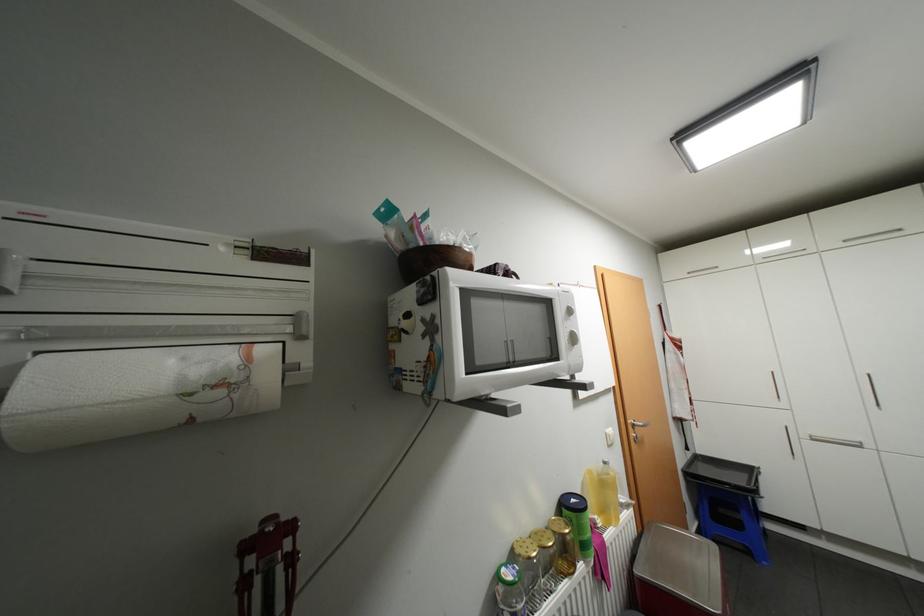
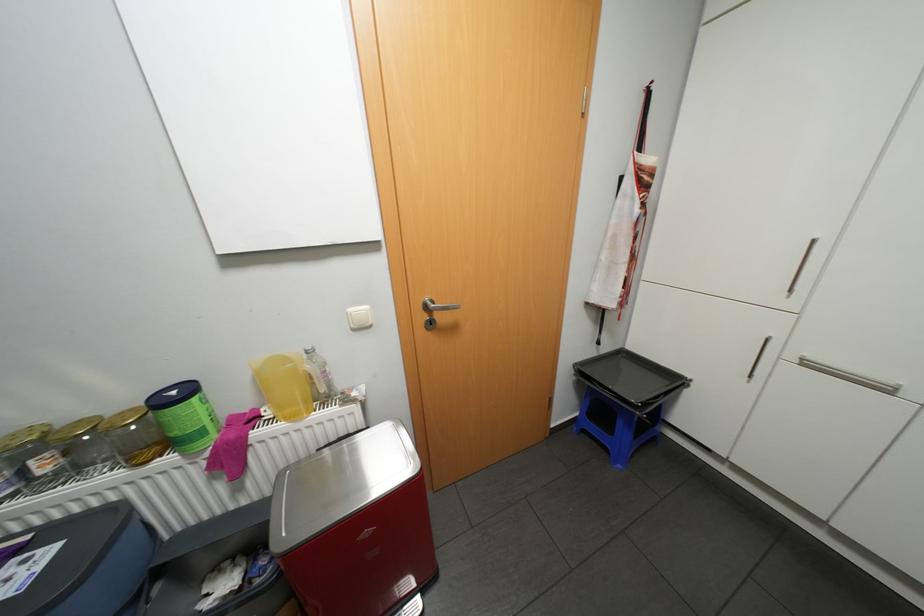
In the second image, find the point that corresponds to (592,560) in the first image.

(190, 453)